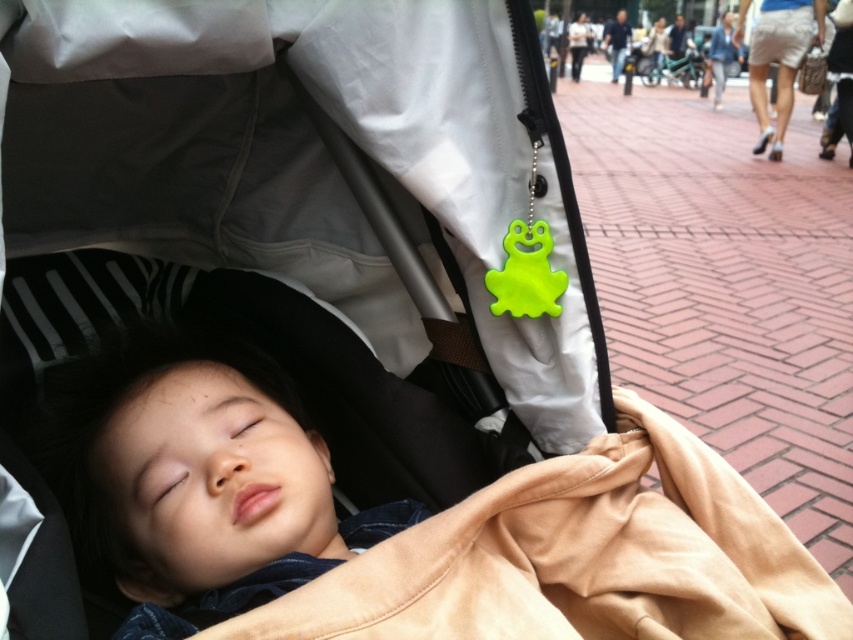
Between matte gray baby carriage at center and smooth skin child at center, which one appears on the right side from the viewer's perspective?

matte gray baby carriage at center is more to the right.

Does matte gray baby carriage at center appear on the left side of smooth skin child at center?

No, matte gray baby carriage at center is not to the left of smooth skin child at center.

Where is `matte gray baby carriage at center`? matte gray baby carriage at center is located at coordinates pos(305,161).

The width and height of the screenshot is (853, 640). Describe the element at coordinates (305, 161) in the screenshot. I see `matte gray baby carriage at center` at that location.

Is matte gray baby carriage at center shorter than smooth beige blanket at center?

In fact, matte gray baby carriage at center may be taller than smooth beige blanket at center.

Find the location of a particular element. The width and height of the screenshot is (853, 640). matte gray baby carriage at center is located at coordinates (305, 161).

Where is `matte gray baby carriage at center`? Image resolution: width=853 pixels, height=640 pixels. matte gray baby carriage at center is located at coordinates (305, 161).

Is smooth beige blanket at center taller than smooth skin child at center?

Yes, smooth beige blanket at center is taller than smooth skin child at center.

Between point (122, 384) and point (131, 456), which one is positioned in front?

Point (131, 456) is in front.

Between point (701, 444) and point (271, 520), which one is positioned in front?

Point (271, 520) is more forward.

Identify the location of smooth beige blanket at center. (403, 522).